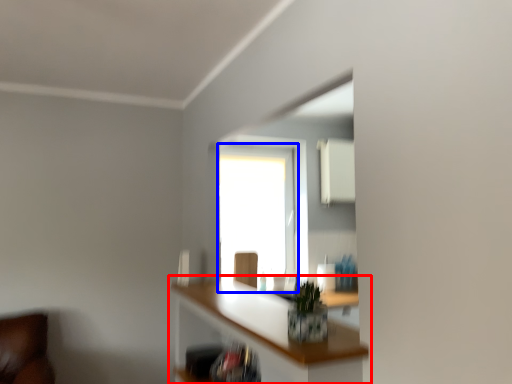
Question: Among these objects, which one is farthest to the camera, shelf (highlighted by a red box) or window (highlighted by a blue box)?

Choices:
 (A) shelf
 (B) window

Answer: (B)